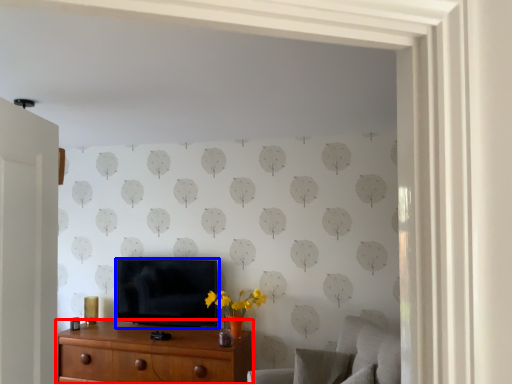
Question: Among these objects, which one is nearest to the camera, chest of drawers (highlighted by a red box) or television (highlighted by a blue box)?

Choices:
 (A) chest of drawers
 (B) television

Answer: (A)